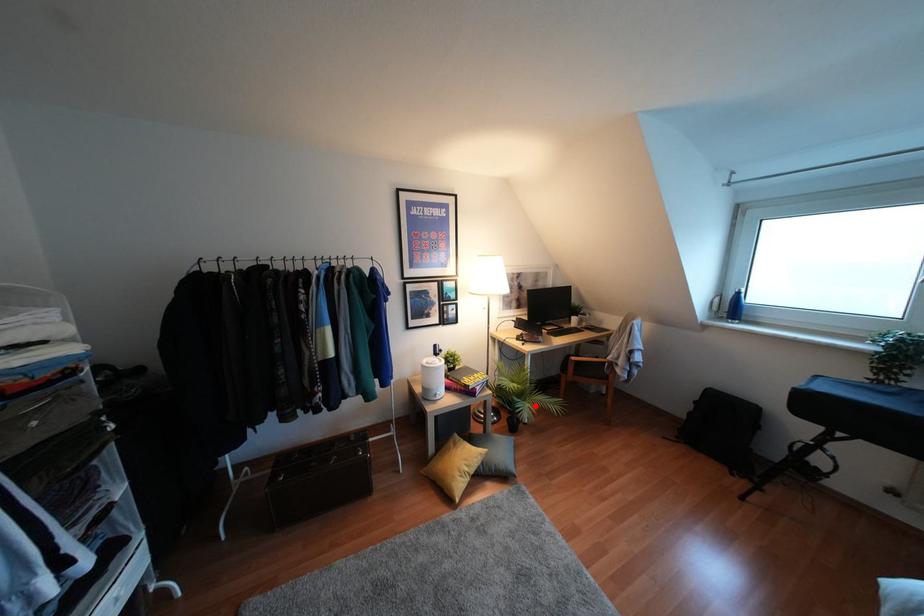
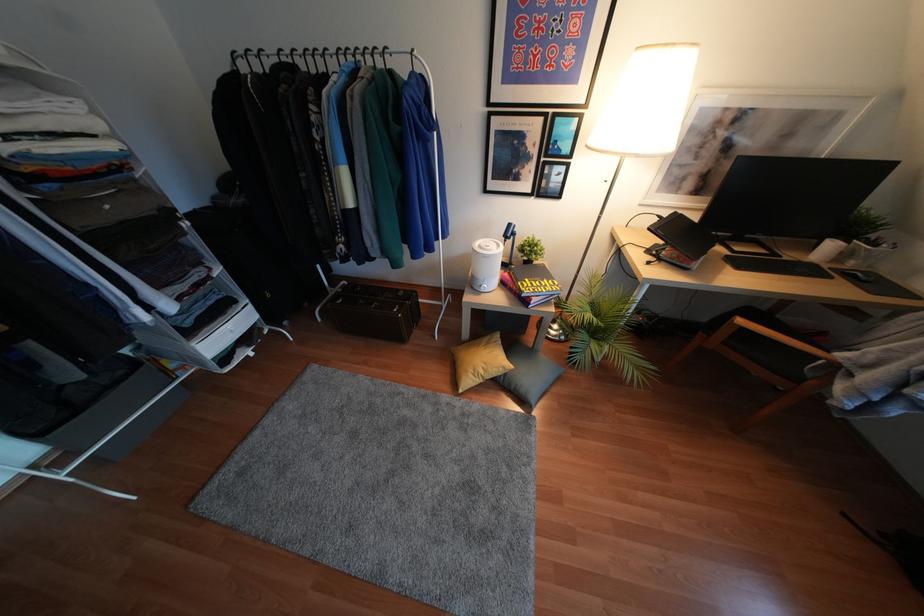
Locate, in the second image, the point that corresponds to the highlighted location in the first image.

(604, 357)